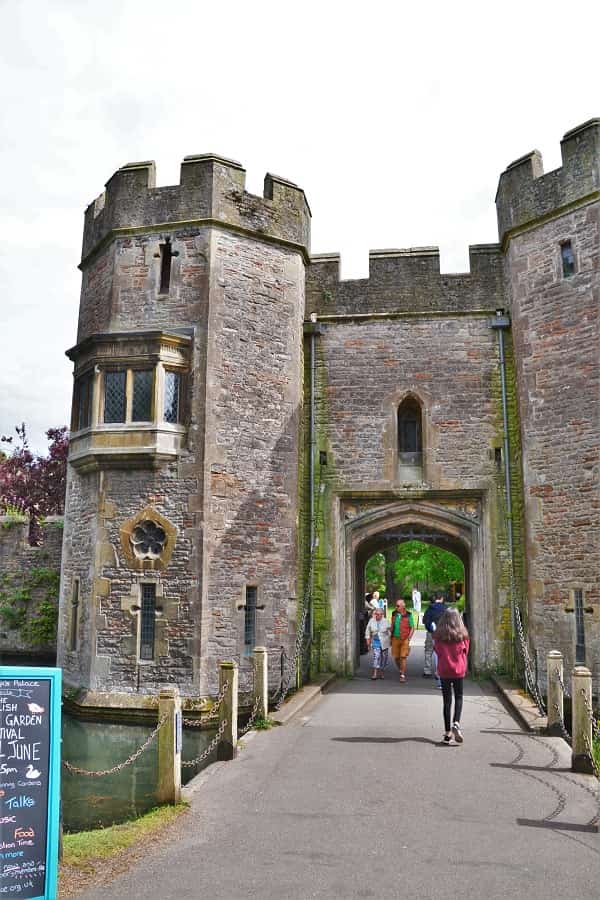
Locate an element on the screen. leaded glass windows is located at coordinates (148, 615), (248, 616), (73, 618), (146, 537).